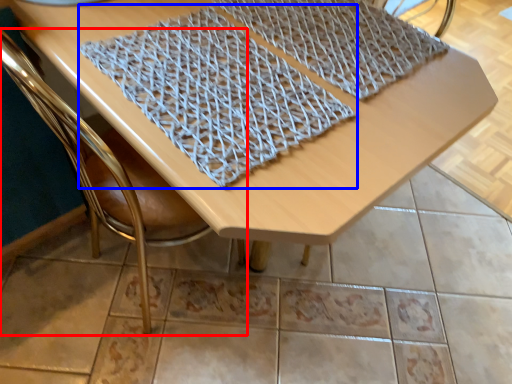
Question: Among these objects, which one is farthest to the camera, chair (highlighted by a red box) or blanket (highlighted by a blue box)?

Choices:
 (A) chair
 (B) blanket

Answer: (B)